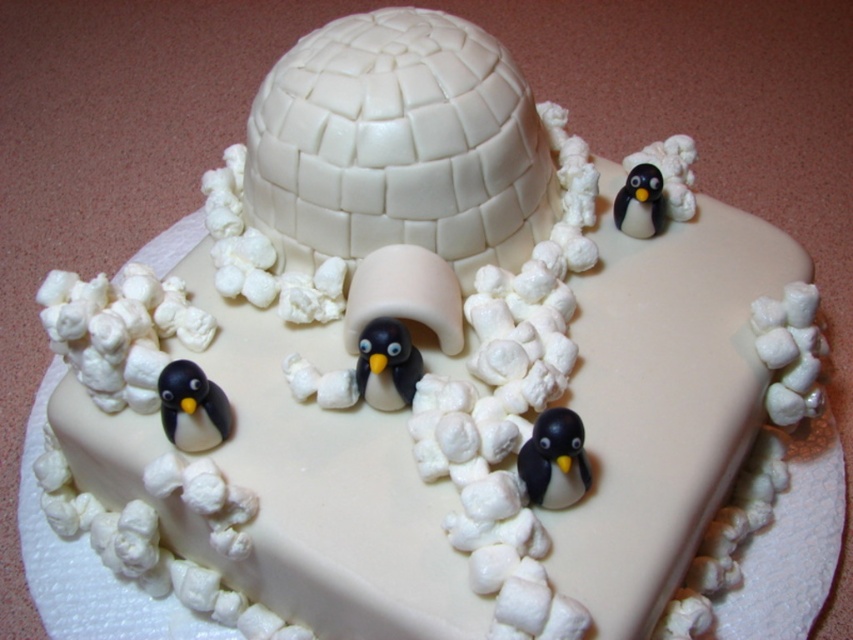
What do you see at coordinates (554, 460) in the screenshot? I see `black glossy penguin at lower center` at bounding box center [554, 460].

Identify the location of black glossy penguin at lower center. This screenshot has height=640, width=853. (554, 460).

Locate an element on the screen. The image size is (853, 640). black glossy penguin at lower center is located at coordinates (554, 460).

Locate an element on the screen. black matte penguin at lower left is located at coordinates (192, 406).

Consider the image. Can you confirm if black matte penguin at lower left is shorter than matte black penguin at center?

Indeed, black matte penguin at lower left has a lesser height compared to matte black penguin at center.

Measure the distance between point (215,396) and camera.

Point (215,396) is 31.42 inches away from camera.

Where is `black matte penguin at lower left`? Image resolution: width=853 pixels, height=640 pixels. black matte penguin at lower left is located at coordinates (192, 406).

Does point (392, 330) lie in front of point (619, 211)?

That is True.

Is matte black penguin at center below black glossy penguin at upper right?

Indeed, matte black penguin at center is positioned under black glossy penguin at upper right.

Does point (363, 397) come closer to viewer compared to point (659, 170)?

Yes, it is.

Find the location of a particular element. This screenshot has height=640, width=853. matte black penguin at center is located at coordinates (387, 364).